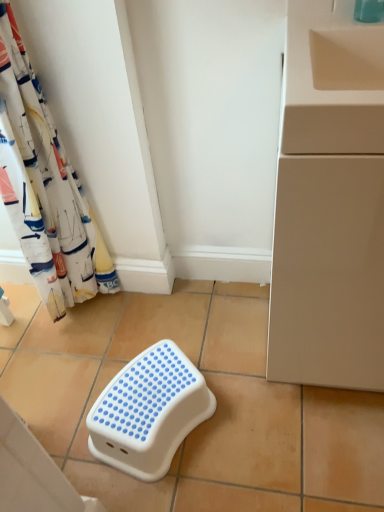
Where is `vacant space situated on the left part of white fabric curtain at left`? The width and height of the screenshot is (384, 512). vacant space situated on the left part of white fabric curtain at left is located at coordinates (37, 327).